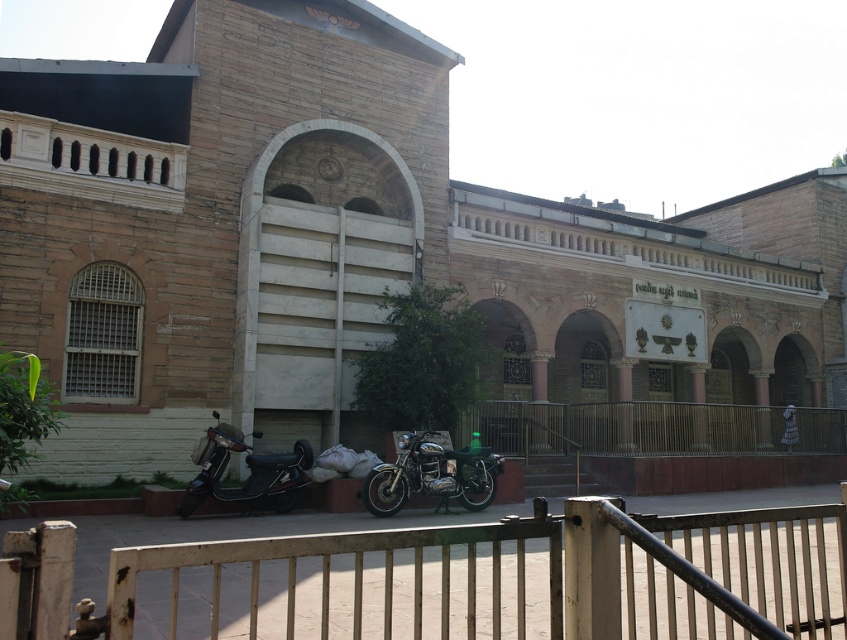
Question: Does rusty metal gate at lower center come in front of shiny metallic motorcycle at center?

Choices:
 (A) no
 (B) yes

Answer: (B)

Question: Which of the following is the farthest from the observer?

Choices:
 (A) (740, 528)
 (B) (469, 490)

Answer: (B)

Question: Which point is closer to the camera taking this photo?

Choices:
 (A) (213, 440)
 (B) (627, 554)

Answer: (B)

Question: Which point is farther to the camera?

Choices:
 (A) (599, 584)
 (B) (391, 486)

Answer: (B)

Question: From the image, what is the correct spatial relationship of rusty metal gate at lower center in relation to shiny metallic motorcycle at center?

Choices:
 (A) below
 (B) above

Answer: (A)

Question: Is rusty metal gate at lower center smaller than black matte scooter at lower left?

Choices:
 (A) yes
 (B) no

Answer: (B)